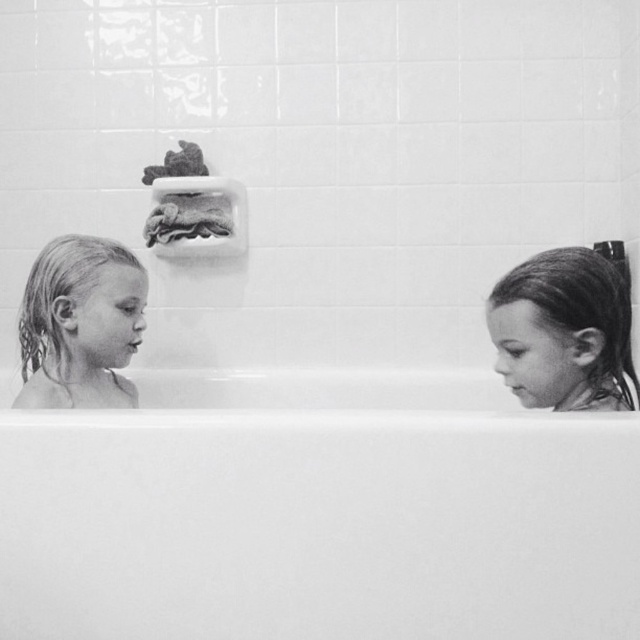
Question: Which object appears farthest from the camera in this image?

Choices:
 (A) wet blonde hair at left
 (B) wet hair at right
 (C) white smooth bathtub at center

Answer: (A)

Question: Which point is farther to the camera?

Choices:
 (A) (556, 397)
 (B) (257, 528)
 (C) (109, 268)

Answer: (C)

Question: Is wet hair at right behind wet blonde hair at left?

Choices:
 (A) no
 (B) yes

Answer: (A)

Question: Is the position of wet hair at right more distant than that of wet blonde hair at left?

Choices:
 (A) yes
 (B) no

Answer: (B)

Question: Considering the real-world distances, which object is farthest from the wet hair at right?

Choices:
 (A) wet blonde hair at left
 (B) white smooth bathtub at center

Answer: (A)

Question: Can you confirm if white smooth bathtub at center is thinner than wet blonde hair at left?

Choices:
 (A) yes
 (B) no

Answer: (B)